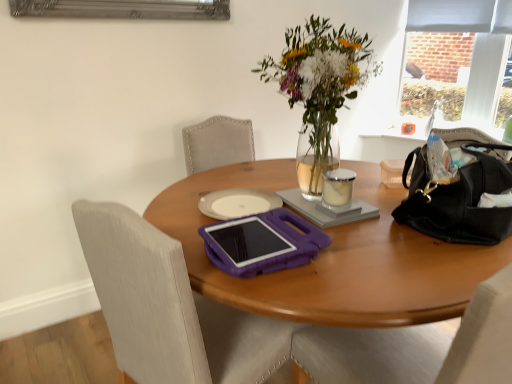
Find the location of `vacant area situated to the left side of clear glass candle at center`. vacant area situated to the left side of clear glass candle at center is located at coordinates (304, 200).